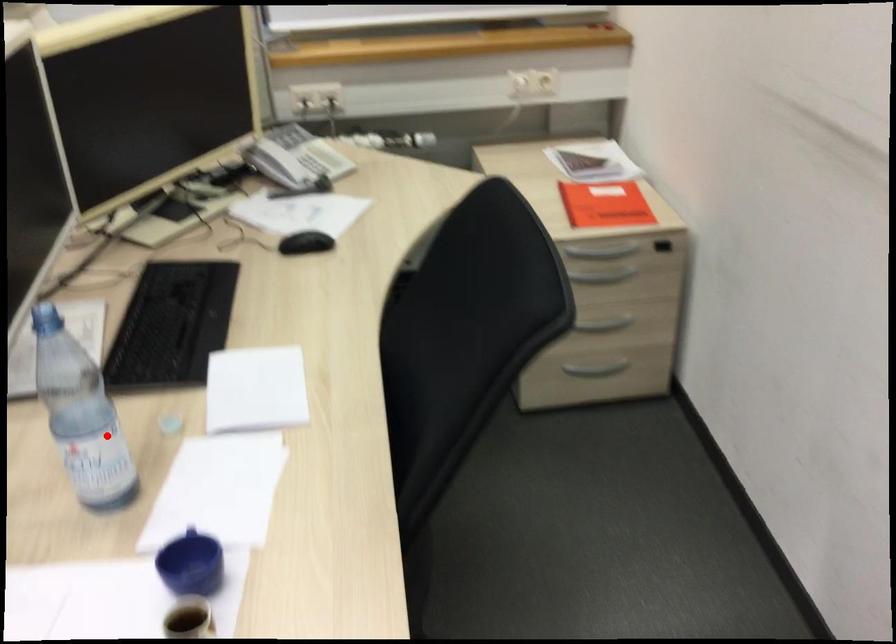
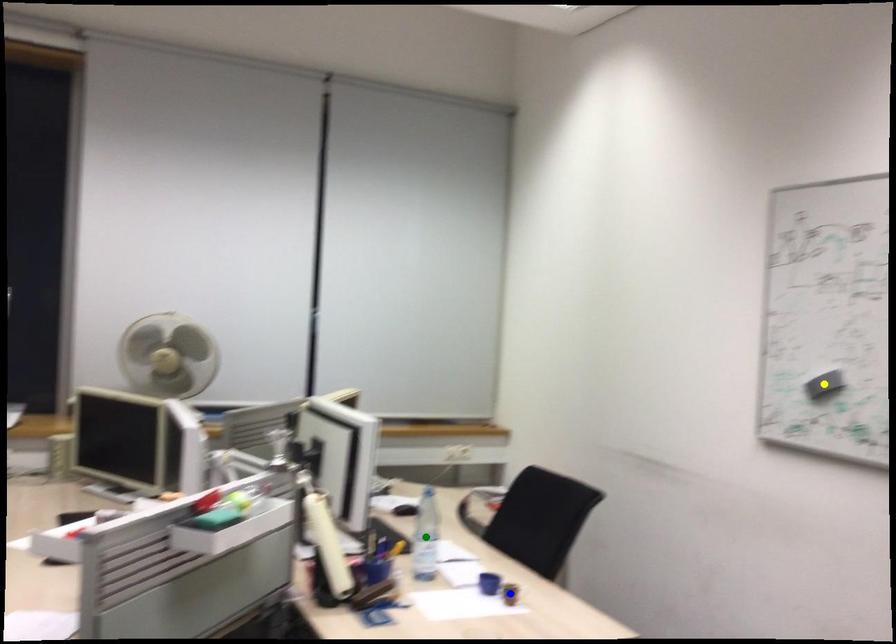
Question: I am providing you with two images of the same scene from different viewpoints. A red point is marked on the first image. You are given multiple points on the second image. In image 2, which mark is for the same physical point as the one in image 1?

Choices:
 (A) green point
 (B) blue point
 (C) yellow point

Answer: (A)